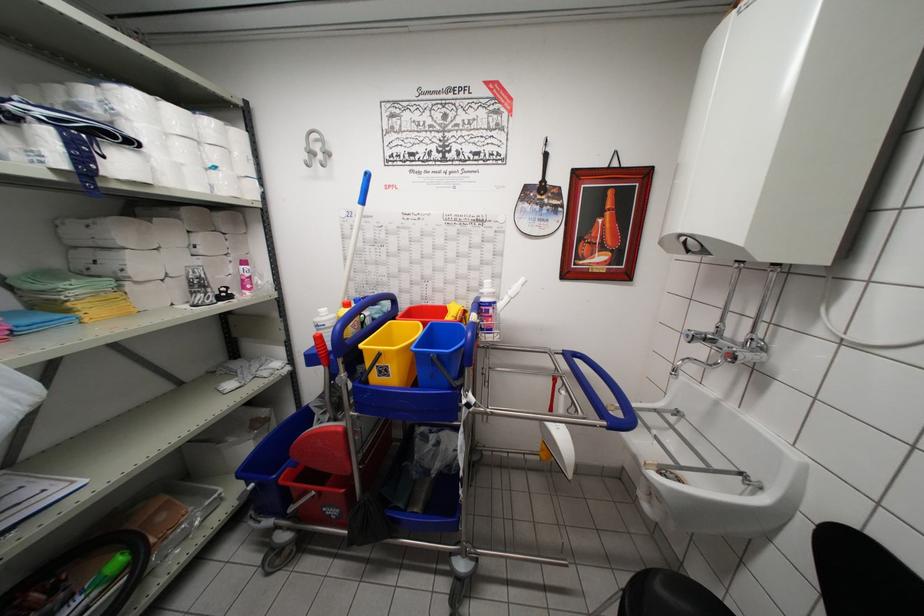
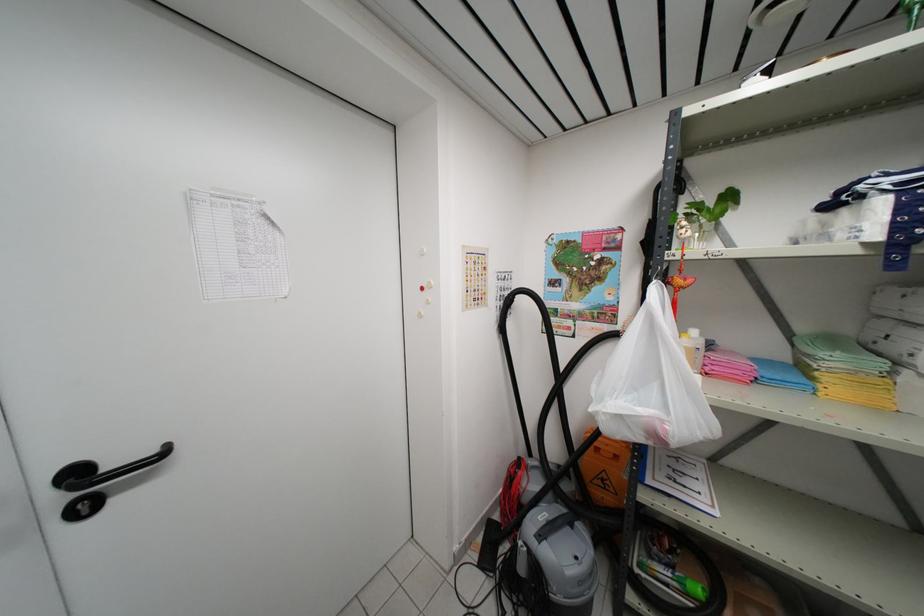
Where in the second image is the point corresponding to the point at 64,321 from the first image?

(806, 385)